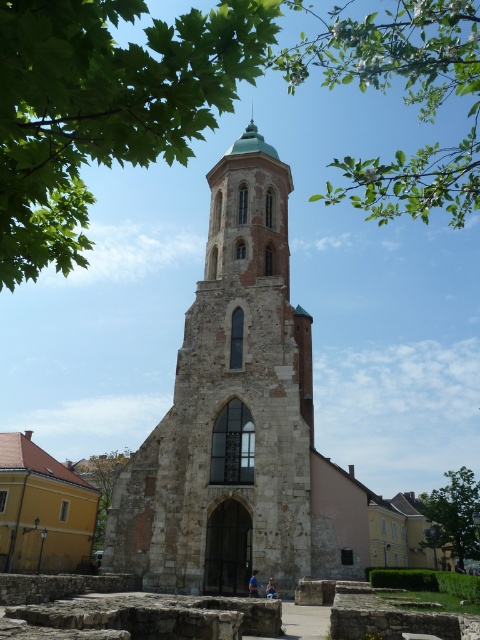
Identify the location of green leafy tree at upper center. (207, 104).

Which of these two, green leafy tree at upper center or yellow matte building at lower left, stands shorter?

yellow matte building at lower left

What do you see at coordinates (207, 104) in the screenshot? Image resolution: width=480 pixels, height=640 pixels. I see `green leafy tree at upper center` at bounding box center [207, 104].

I want to click on green leafy tree at upper center, so click(207, 104).

Is point (96, 29) positioned after point (262, 237)?

That is False.

Is green leafy tree at upper center above stone church at center?

Correct, green leafy tree at upper center is located above stone church at center.

Who is more distant from viewer, (15, 264) or (250, 384)?

Positioned behind is point (250, 384).

The width and height of the screenshot is (480, 640). I want to click on green leafy tree at upper center, so click(207, 104).

Where is `yellow matte building at lower left`? Image resolution: width=480 pixels, height=640 pixels. yellow matte building at lower left is located at coordinates (41, 509).

Measure the distance from yellow matte building at lower left to green leafy tree at lower left.

The distance of yellow matte building at lower left from green leafy tree at lower left is 9.21 meters.

This screenshot has width=480, height=640. What are the coordinates of `yellow matte building at lower left` in the screenshot? It's located at (41, 509).